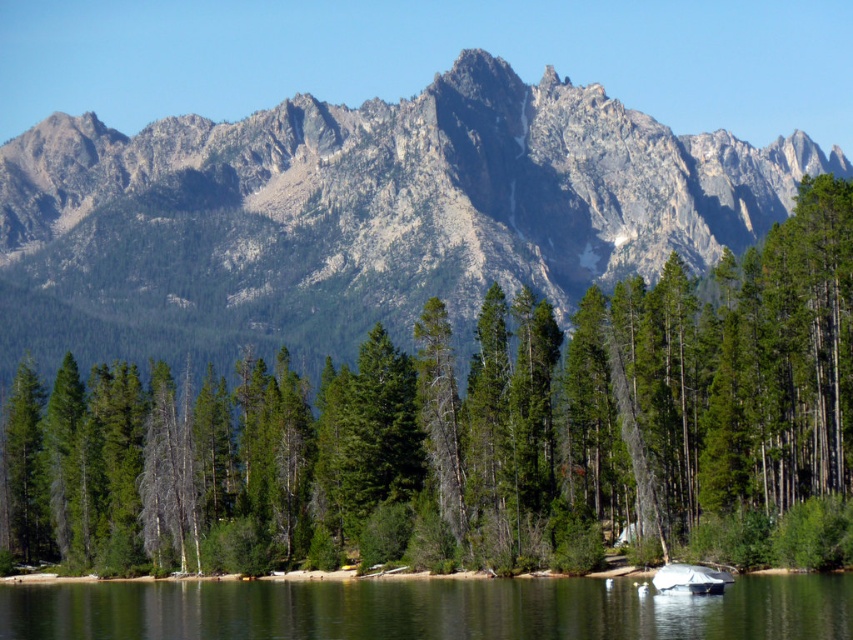
You are a hiker standing at the edge of the clear water at lower center. Looking towards the rocky gray mountain range at upper center, which direction do you need to look to see the mountain range?

The rocky gray mountain range at upper center is positioned over the clear water at lower center, so you need to look upward to see the mountain range.

You are standing in the natural landscape and want to take a photo of the green matte tree at center and the rocky gray mountain range at upper center. Which object will appear larger in the photo?

The green matte tree at center will appear larger in the photo because it is closer to the viewer than the rocky gray mountain range at upper center.

You are an environmental scientist studying the landscape. You observe the green matte tree at center and the rocky gray mountain range at upper center. Which of these two has a greater height in the image?

The rocky gray mountain range at upper center is taller than the green matte tree at center.